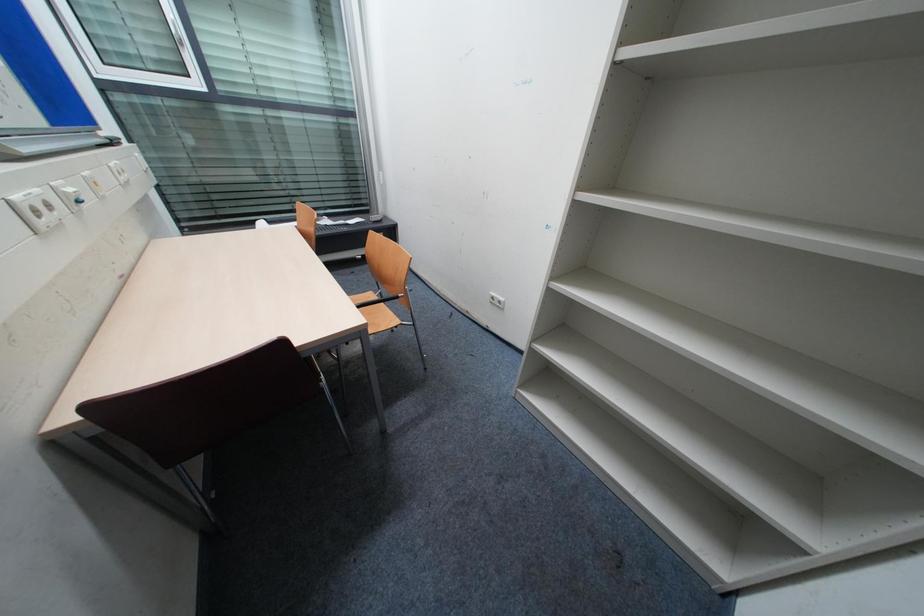
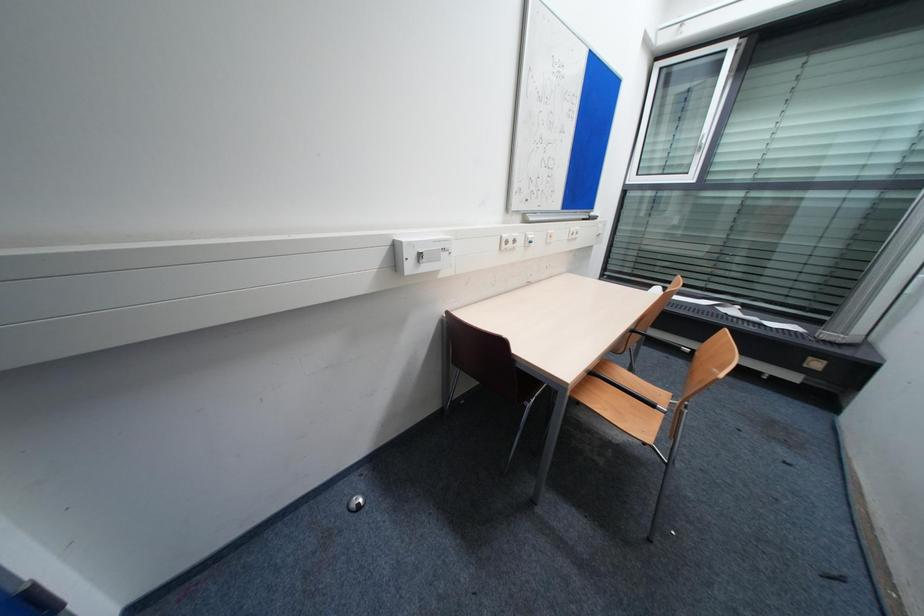
Question: Based on the continuous images, in which direction is the camera rotating? Reply with the corresponding letter.

Choices:
 (A) Left
 (B) Right
 (C) Up
 (D) Down

Answer: (A)